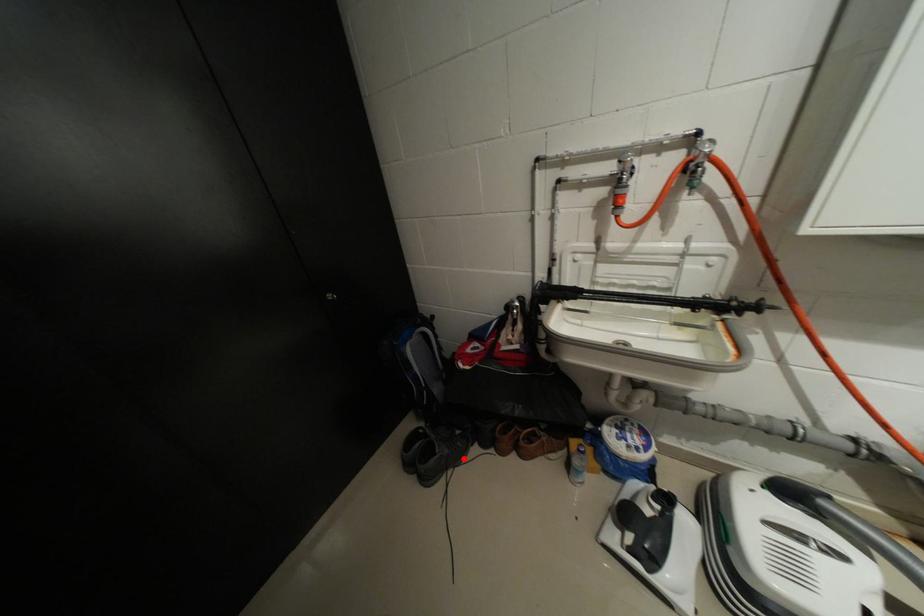
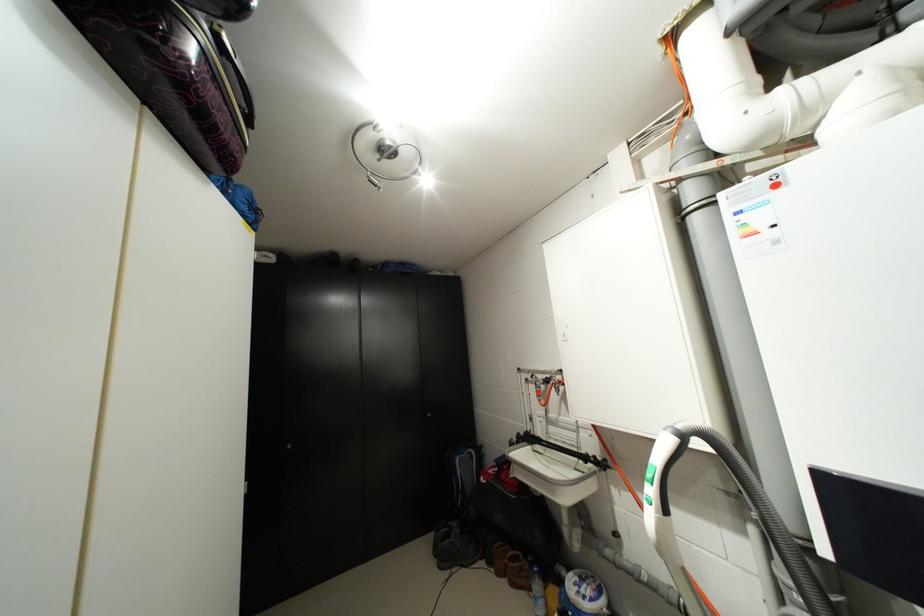
Find the pixel in the second image that matches the highlighted location in the first image.

(473, 562)